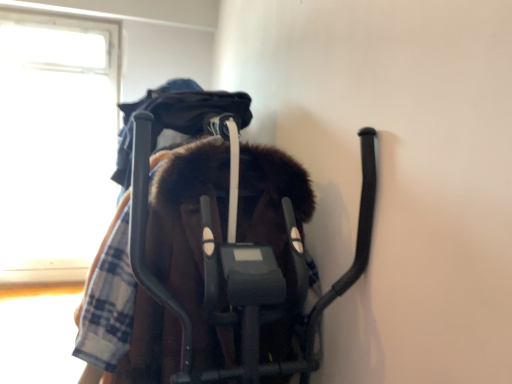
Question: From the image's perspective, is transparent glass window at upper left on brown fuzzy coat at center?

Choices:
 (A) yes
 (B) no

Answer: (A)

Question: From a real-world perspective, is transparent glass window at upper left positioned under brown fuzzy coat at center based on gravity?

Choices:
 (A) no
 (B) yes

Answer: (A)

Question: Is transparent glass window at upper left beside brown fuzzy coat at center?

Choices:
 (A) no
 (B) yes

Answer: (A)

Question: From the image's perspective, is transparent glass window at upper left under brown fuzzy coat at center?

Choices:
 (A) no
 (B) yes

Answer: (A)

Question: Is transparent glass window at upper left positioned with its back to brown fuzzy coat at center?

Choices:
 (A) no
 (B) yes

Answer: (A)

Question: Is transparent glass window at upper left oriented towards brown fuzzy coat at center?

Choices:
 (A) yes
 (B) no

Answer: (A)

Question: From a real-world perspective, is brown fuzzy coat at center on top of transparent glass window at upper left?

Choices:
 (A) no
 (B) yes

Answer: (A)

Question: Is brown fuzzy coat at center bigger than transparent glass window at upper left?

Choices:
 (A) yes
 (B) no

Answer: (A)

Question: Could transparent glass window at upper left be considered to be inside brown fuzzy coat at center?

Choices:
 (A) yes
 (B) no

Answer: (B)

Question: Is the position of brown fuzzy coat at center more distant than that of transparent glass window at upper left?

Choices:
 (A) no
 (B) yes

Answer: (A)

Question: Does brown fuzzy coat at center have a lesser height compared to transparent glass window at upper left?

Choices:
 (A) yes
 (B) no

Answer: (A)

Question: From the image's perspective, is brown fuzzy coat at center above transparent glass window at upper left?

Choices:
 (A) no
 (B) yes

Answer: (A)

Question: From the image's perspective, is brown fuzzy coat at center above or below transparent glass window at upper left?

Choices:
 (A) below
 (B) above

Answer: (A)